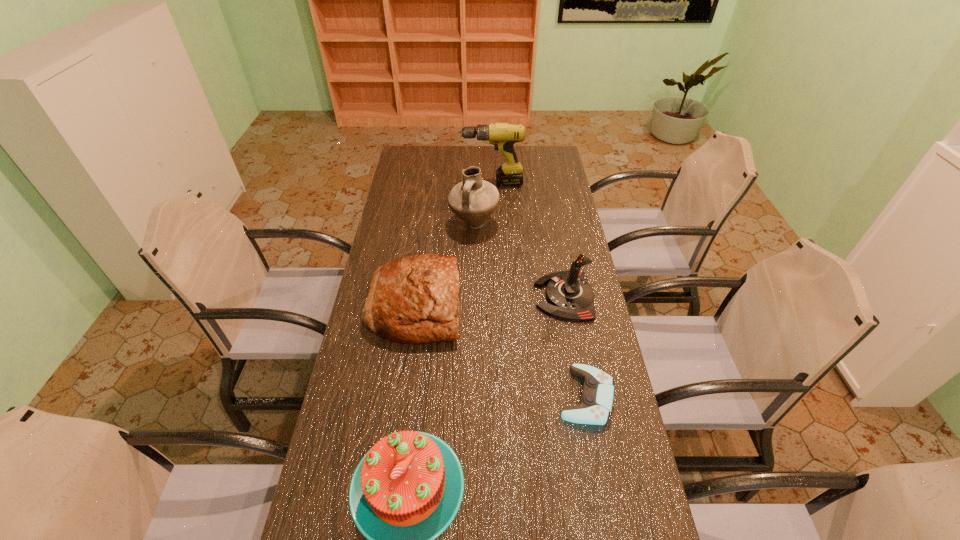
Find the location of `drill`. drill is located at coordinates pyautogui.click(x=503, y=136).

Identify the location of the second farthest object. (473, 200).

Where is `joystick`? The height and width of the screenshot is (540, 960). joystick is located at coordinates (570, 297).

Identify the location of bread. point(415,299).

Image resolution: width=960 pixels, height=540 pixels. I want to click on the shortest object, so click(x=595, y=406).

The image size is (960, 540). I want to click on control, so click(595, 406).

Where is `free location located on the handle side of the drill`? The height and width of the screenshot is (540, 960). free location located on the handle side of the drill is located at coordinates (414, 183).

The image size is (960, 540). I want to click on vacant space located on the handle side of the drill, so click(x=407, y=183).

This screenshot has width=960, height=540. In order to click on blank space located 0.110m on the handle side of the drill in this screenshot , I will do `click(436, 183)`.

You are a GUI agent. You are given a task and a screenshot of the screen. Output one action in this format:
    pyautogui.click(x=<x>, y=<y>)
    Task: Click on the vacant space located on the handle side of the second farthest object
    
    Given the screenshot: What is the action you would take?
    pyautogui.click(x=473, y=250)